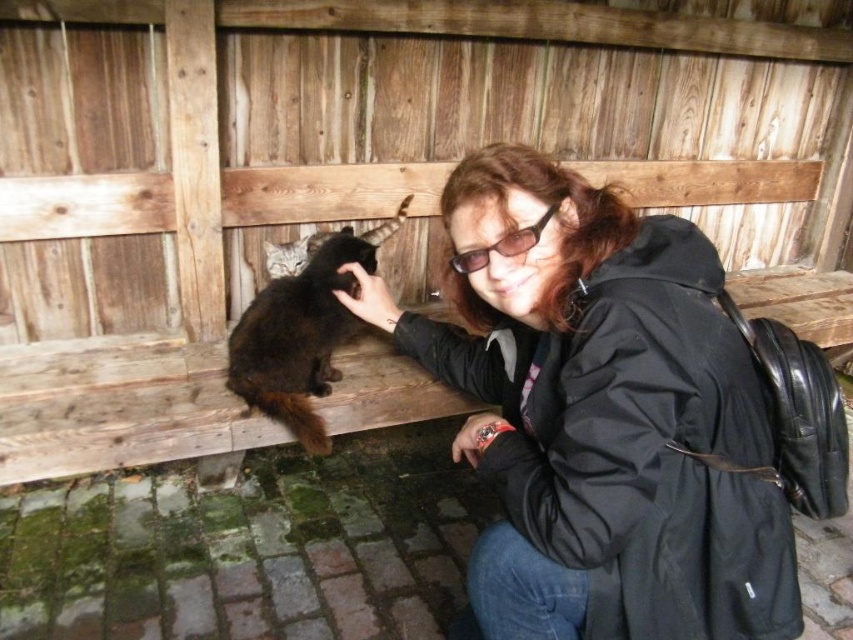
Question: Is black matte jacket at center wider than dark brown fur cat at upper left?

Choices:
 (A) yes
 (B) no

Answer: (A)

Question: Can you confirm if black matte jacket at center is positioned above dark brown fur cat at upper left?

Choices:
 (A) no
 (B) yes

Answer: (A)

Question: Which of the following is the farthest from the observer?

Choices:
 (A) black matte jacket at center
 (B) dark brown fur cat at upper left

Answer: (B)

Question: Among these objects, which one is farthest from the camera?

Choices:
 (A) dark brown fur cat at upper left
 (B) black matte jacket at center

Answer: (A)

Question: Which of the following is the closest to the observer?

Choices:
 (A) (473, 324)
 (B) (283, 410)

Answer: (A)

Question: Does black matte jacket at center come in front of dark brown fur cat at upper left?

Choices:
 (A) no
 (B) yes

Answer: (B)